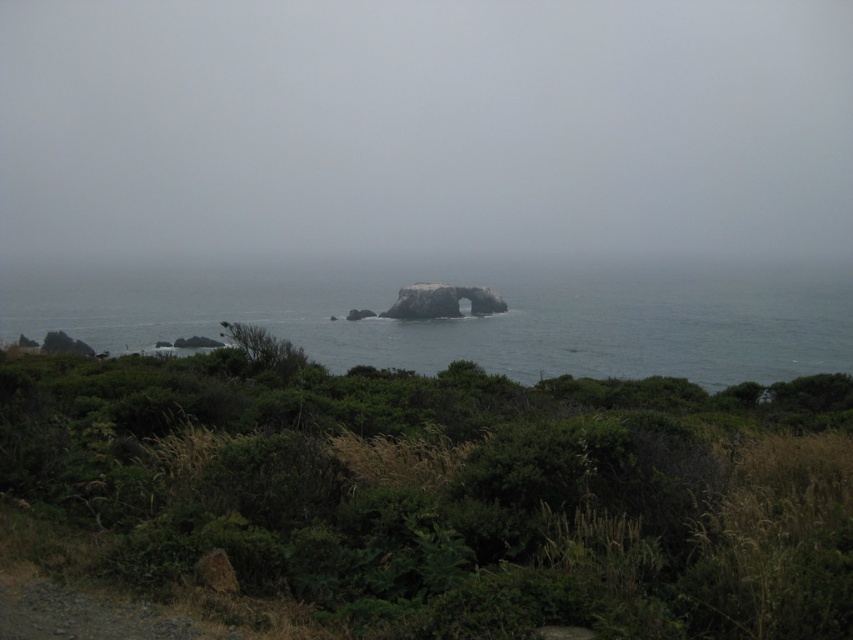
Which of these two, green leafy shrubs at center or gray rock at center, stands taller?

With more height is gray rock at center.

Does green leafy shrubs at center appear over gray rock at center?

No.

Is point (601, 513) positioned in front of point (273, 280)?

That is True.

At what (x,y) coordinates should I click in order to perform the action: click on green leafy shrubs at center. Please return your answer as a coordinate pair (x, y). Looking at the image, I should click on (451, 490).